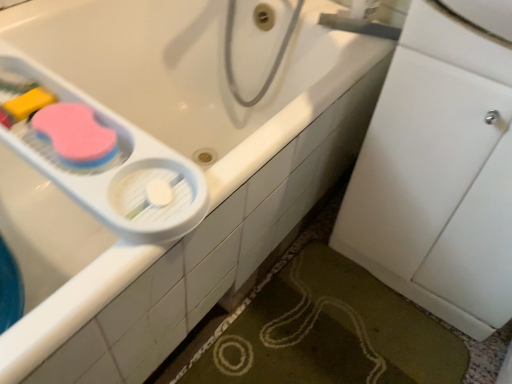
Question: From a real-world perspective, is white plastic container at upper left beneath white plastic faucet at upper right?

Choices:
 (A) no
 (B) yes

Answer: (B)

Question: Considering the relative positions of white plastic container at upper left and white plastic faucet at upper right in the image provided, is white plastic container at upper left behind white plastic faucet at upper right?

Choices:
 (A) no
 (B) yes

Answer: (A)

Question: Does white plastic container at upper left have a smaller size compared to white plastic faucet at upper right?

Choices:
 (A) no
 (B) yes

Answer: (A)

Question: Is the surface of white plastic container at upper left in direct contact with white plastic faucet at upper right?

Choices:
 (A) yes
 (B) no

Answer: (B)

Question: Considering the relative sizes of white plastic container at upper left and white plastic faucet at upper right in the image provided, is white plastic container at upper left taller than white plastic faucet at upper right?

Choices:
 (A) no
 (B) yes

Answer: (B)

Question: Considering the positions of green textured bath mat at lower right and white plastic container at upper left in the image, is green textured bath mat at lower right wider or thinner than white plastic container at upper left?

Choices:
 (A) wide
 (B) thin

Answer: (A)

Question: Is green textured bath mat at lower right inside the boundaries of white plastic container at upper left, or outside?

Choices:
 (A) inside
 (B) outside

Answer: (B)

Question: Is green textured bath mat at lower right taller or shorter than white plastic container at upper left?

Choices:
 (A) short
 (B) tall

Answer: (A)

Question: Does point (320, 258) appear closer or farther from the camera than point (126, 129)?

Choices:
 (A) closer
 (B) farther

Answer: (B)

Question: Is point (369, 26) positioned closer to the camera than point (360, 271)?

Choices:
 (A) closer
 (B) farther

Answer: (A)

Question: Based on their sizes in the image, would you say white plastic faucet at upper right is bigger or smaller than green textured bath mat at lower right?

Choices:
 (A) small
 (B) big

Answer: (A)

Question: In the image, is white plastic faucet at upper right positioned in front of or behind green textured bath mat at lower right?

Choices:
 (A) behind
 (B) front

Answer: (A)

Question: Looking at their shapes, would you say white plastic faucet at upper right is wider or thinner than green textured bath mat at lower right?

Choices:
 (A) thin
 (B) wide

Answer: (A)

Question: Would you say white plastic faucet at upper right is to the left or to the right of white plastic container at upper left in the picture?

Choices:
 (A) left
 (B) right

Answer: (B)

Question: Based on their sizes in the image, would you say white plastic faucet at upper right is bigger or smaller than white plastic container at upper left?

Choices:
 (A) big
 (B) small

Answer: (B)